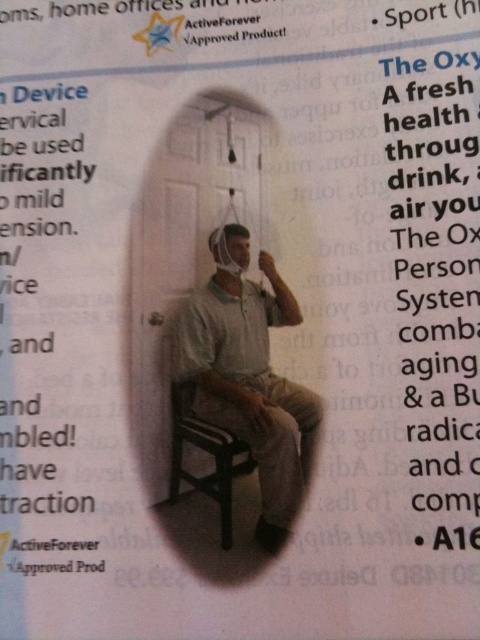
Where is the matte white shirt at center located in the image?

The matte white shirt at center is located at point (249, 376) in the image.

You are a fashion designer looking at the ActiveForever advertisement. You notice the matte white shirt at center and the wooden chair at lower center. Which object is covering the other one in the image?

The matte white shirt at center is positioned over the wooden chair at lower center, so it is covering the chair.